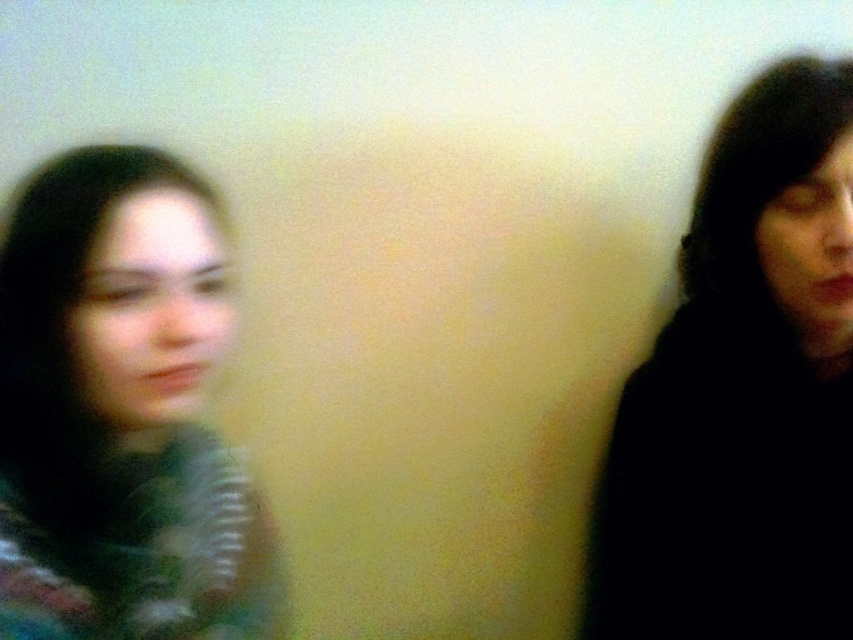
Between black matte hair at right and matte green sweater at left, which one has less height?

Standing shorter between the two is matte green sweater at left.

Who is taller, black matte hair at right or matte green sweater at left?

black matte hair at right

What do you see at coordinates (743, 394) in the screenshot? I see `black matte hair at right` at bounding box center [743, 394].

Locate an element on the screen. This screenshot has height=640, width=853. black matte hair at right is located at coordinates (743, 394).